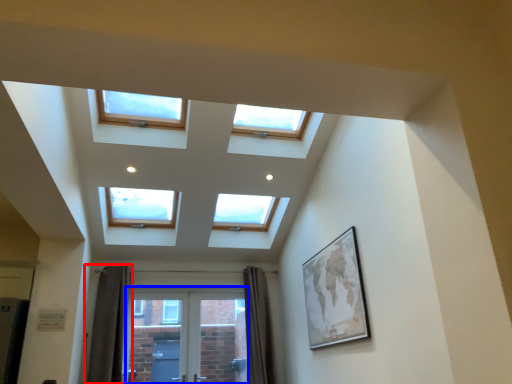
Question: Which object is further to the camera taking this photo, curtain (highlighted by a red box) or screen door (highlighted by a blue box)?

Choices:
 (A) curtain
 (B) screen door

Answer: (B)